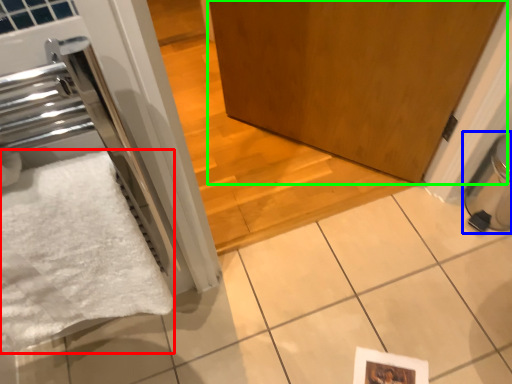
Question: Estimate the real-world distances between objects in this image. Which object is closer to bath towel (highlighted by a red box), water heater (highlighted by a blue box) or door (highlighted by a green box)?

Choices:
 (A) water heater
 (B) door

Answer: (B)